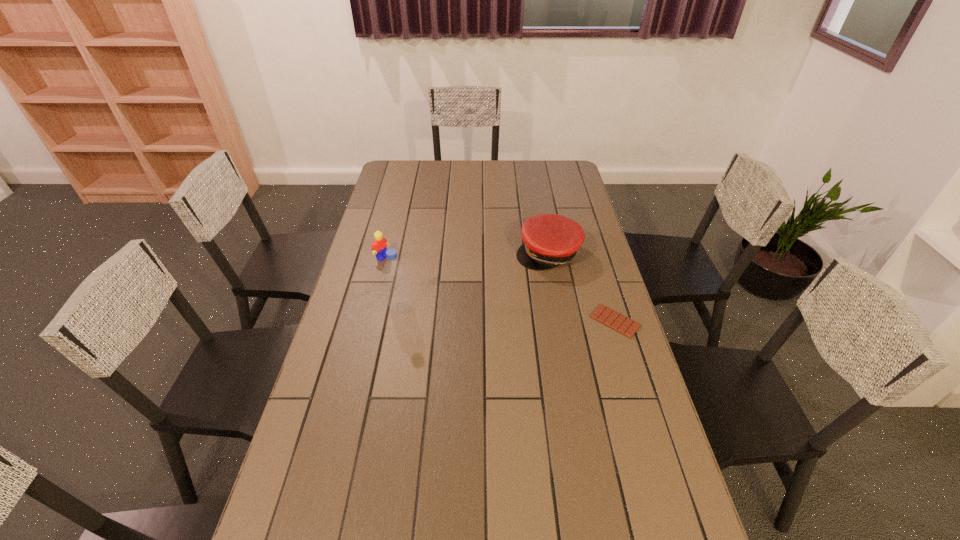
You are a GUI agent. You are given a task and a screenshot of the screen. Output one action in this format:
    pyautogui.click(x=<x>, y=<y>)
    Task: Click on the vacant space on the desktop that is between the third object from right to left and the shortest object and is positioned at the front of the cap where the visor is located
    
    Given the screenshot: What is the action you would take?
    pyautogui.click(x=532, y=316)

Identify the location of free spot on the desktop that is between the bottle and the shortest object and is positioned on the front-facing side of the leftmost object. The image size is (960, 540). (479, 313).